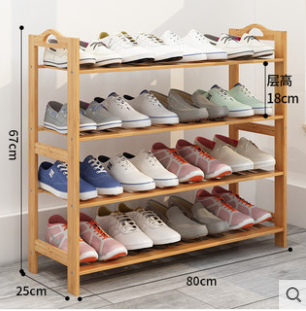
Identify the location of shoes on the bottom shelf. This screenshot has height=311, width=306. (89, 248), (111, 241), (126, 236), (151, 232), (187, 221), (208, 213), (220, 212), (244, 209).